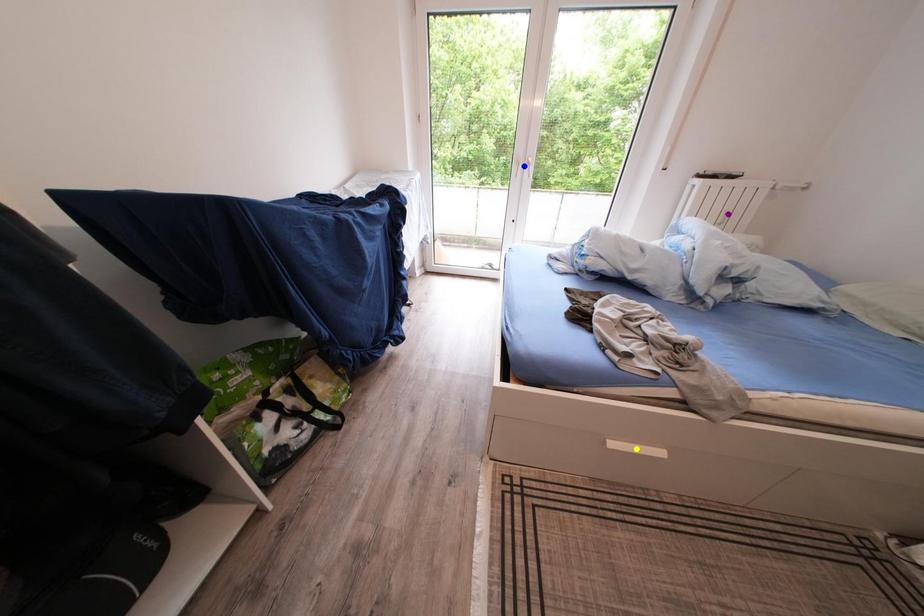
Order these from farthest to nearest:
1. purple point
2. yellow point
3. blue point

1. blue point
2. purple point
3. yellow point